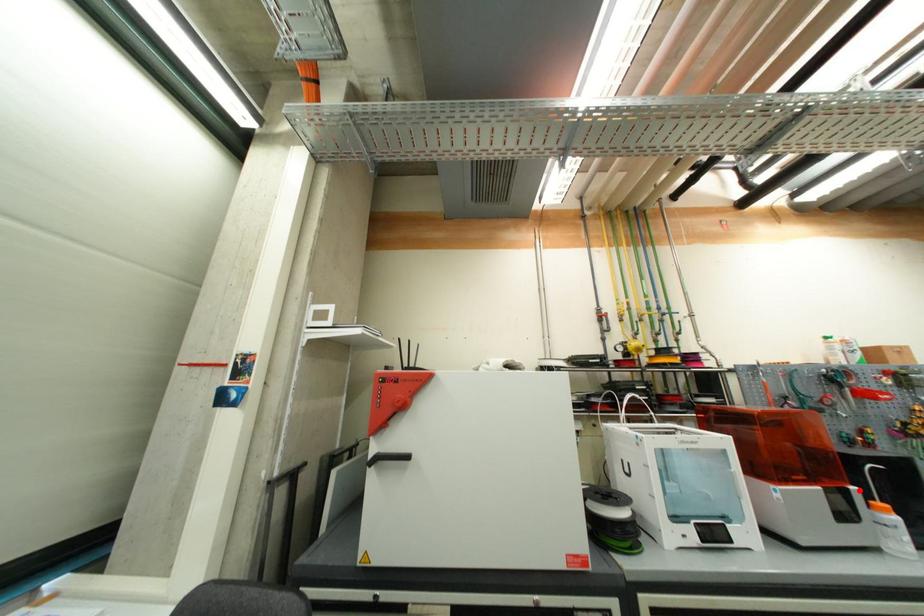
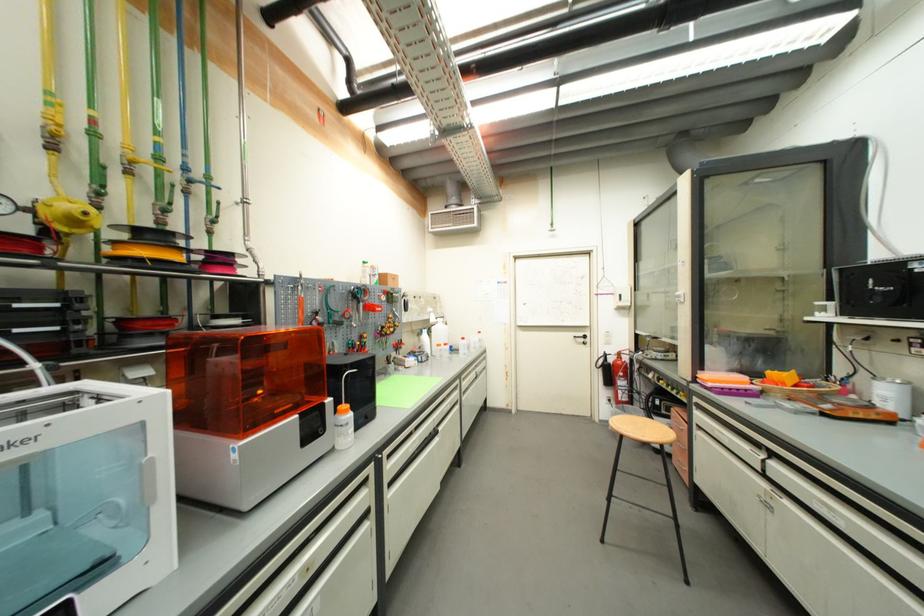
Question: I am providing you with two images of the same scene from different viewpoints. A red point is shown in image1. For the corresponding object point in image2, is it positioned nearer or farther from the camera?

Choices:
 (A) Nearer
 (B) Farther

Answer: (B)